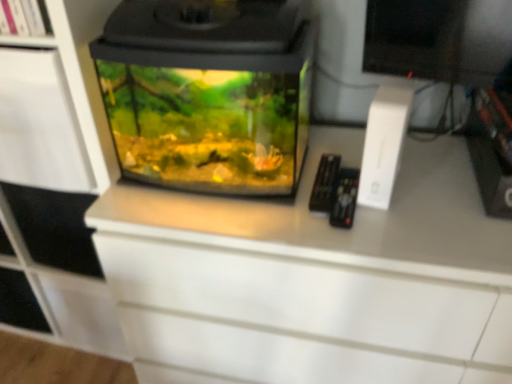
Question: Is white matte cabinet at left shorter than white matte shelf at upper left?

Choices:
 (A) yes
 (B) no

Answer: (B)

Question: Does white matte cabinet at left come in front of white matte shelf at upper left?

Choices:
 (A) yes
 (B) no

Answer: (B)

Question: Does white matte cabinet at left appear on the left side of white matte shelf at upper left?

Choices:
 (A) no
 (B) yes

Answer: (B)

Question: Can you see white matte cabinet at left touching white matte shelf at upper left?

Choices:
 (A) no
 (B) yes

Answer: (A)

Question: Is white matte cabinet at left positioned far away from white matte shelf at upper left?

Choices:
 (A) yes
 (B) no

Answer: (B)

Question: Based on their positions, is white matte cabinet at left located to the left or right of white matte shelf at upper left?

Choices:
 (A) right
 (B) left

Answer: (B)

Question: Is white matte cabinet at left bigger or smaller than white matte shelf at upper left?

Choices:
 (A) big
 (B) small

Answer: (A)

Question: Would you say white matte cabinet at left is inside or outside white matte shelf at upper left?

Choices:
 (A) inside
 (B) outside

Answer: (B)

Question: Is point (86, 87) positioned closer to the camera than point (30, 0)?

Choices:
 (A) closer
 (B) farther

Answer: (B)

Question: In terms of height, does white matte shelf at upper left look taller or shorter compared to white matte cabinet at left?

Choices:
 (A) tall
 (B) short

Answer: (B)

Question: From a real-world perspective, is white matte shelf at upper left positioned above or below white matte cabinet at left?

Choices:
 (A) above
 (B) below

Answer: (A)

Question: Based on their positions, is white matte shelf at upper left located to the left or right of white matte cabinet at left?

Choices:
 (A) right
 (B) left

Answer: (A)

Question: Is white matte shelf at upper left bigger or smaller than white matte cabinet at left?

Choices:
 (A) small
 (B) big

Answer: (A)

Question: Visually, is transparent glass aquarium at center positioned to the left or to the right of white matte cabinet at left?

Choices:
 (A) right
 (B) left

Answer: (A)

Question: Is point (267, 185) closer or farther from the camera than point (46, 281)?

Choices:
 (A) closer
 (B) farther

Answer: (A)